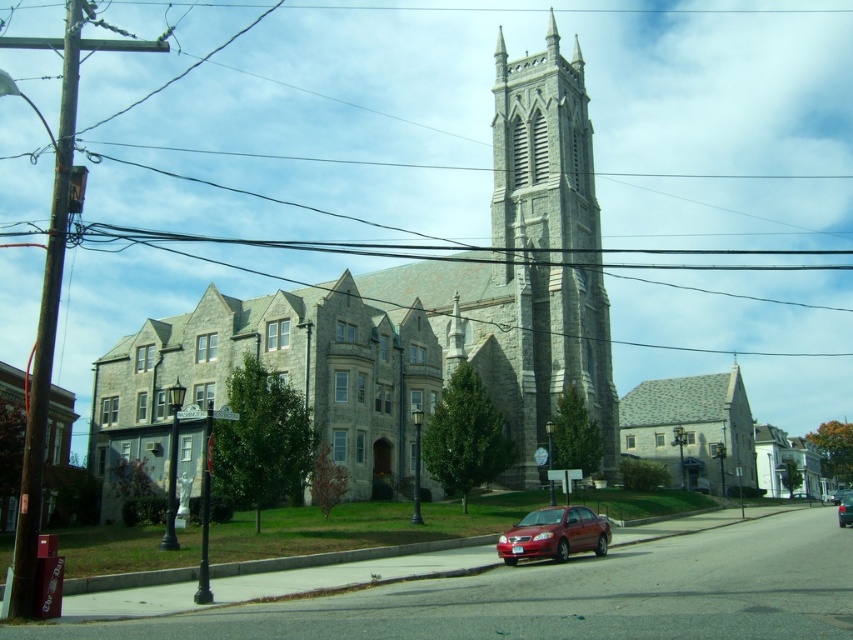
Question: Which object is farther from the camera taking this photo?

Choices:
 (A) shiny red sedan at center
 (B) gray stone church at center
 (C) gray stone church at lower right

Answer: (C)

Question: Which of the following is the closest to the observer?

Choices:
 (A) (848, 497)
 (B) (498, 109)

Answer: (B)

Question: Can you confirm if gray stone church at lower right is positioned above metallic red sedan at center?

Choices:
 (A) no
 (B) yes

Answer: (B)

Question: Does shiny red sedan at center come behind metallic red sedan at center?

Choices:
 (A) no
 (B) yes

Answer: (A)

Question: Estimate the real-world distances between objects in this image. Which object is closer to the gray stone tower at center?

Choices:
 (A) gray stone church at lower right
 (B) metallic red sedan at center

Answer: (A)

Question: Is gray stone church at center positioned behind metallic red sedan at center?

Choices:
 (A) no
 (B) yes

Answer: (A)